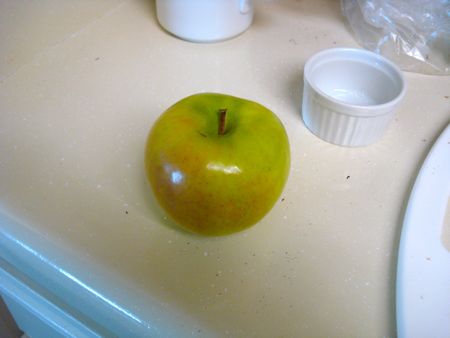
Identify the location of countertop. The image size is (450, 338). (242, 275).